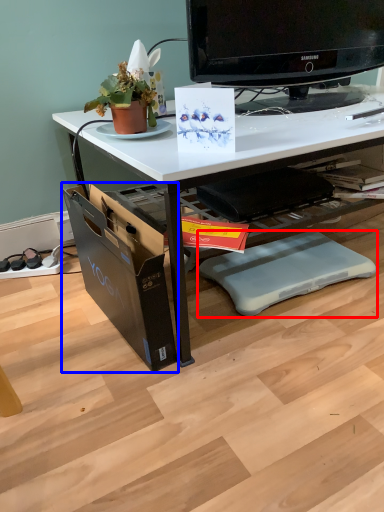
Question: Which object appears closest to the camera in this image, swivel chair (highlighted by a red box) or file cabinet (highlighted by a blue box)?

Choices:
 (A) swivel chair
 (B) file cabinet

Answer: (B)